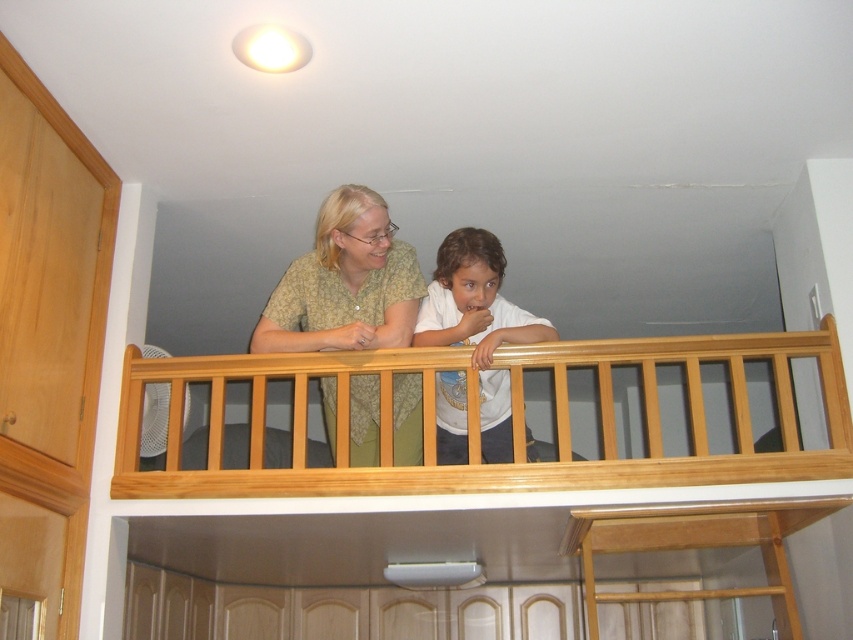
Question: Which object is the closest to the white matte shirt at center?

Choices:
 (A) green matte shirt at upper center
 (B) light brown wood at upper center

Answer: (A)

Question: Is the position of green matte shirt at upper center less distant than that of white matte shirt at center?

Choices:
 (A) yes
 (B) no

Answer: (A)

Question: Which of the following is the farthest from the observer?

Choices:
 (A) light brown wood at upper center
 (B) green matte shirt at upper center
 (C) white matte shirt at center

Answer: (C)

Question: Is light brown wood at upper center above white matte shirt at center?

Choices:
 (A) yes
 (B) no

Answer: (B)

Question: Can you confirm if light brown wood at upper center is smaller than white matte shirt at center?

Choices:
 (A) yes
 (B) no

Answer: (B)

Question: Which point is farther from the camera taking this photo?

Choices:
 (A) (305, 332)
 (B) (496, 477)
 (C) (480, 236)

Answer: (A)